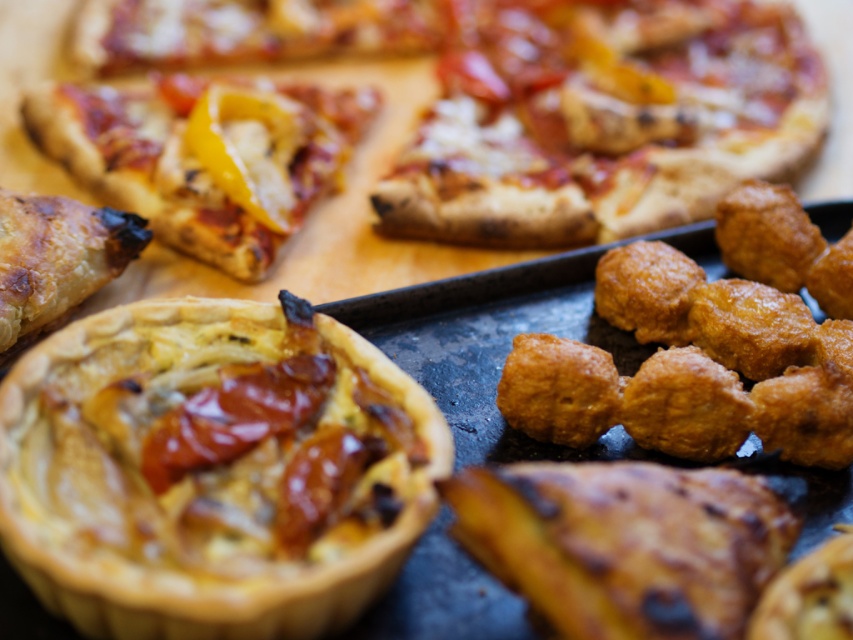
You are a customer at a bakery and want to buy the golden brown flaky pastry at lower right. The pastry is located at point coordinates of (625,544). The bakery has a rule that items located at coordinates with a sum greater than 1.5 cannot be purchased. What is the sum of the coordinates of the pastry?

The coordinates of the golden brown flaky pastry at lower right are 0.850 and 0.734. Adding these together, 0.850 plus 0.734 equals 1.584. The sum is 1.584, which is greater than 1.5, so the pastry cannot be purchased.

You are a customer at a bakery and want to choose the taller pastry between the golden brown flaky pastry at lower right and the golden brown flaky pastry at lower left. Which one should you choose?

The golden brown flaky pastry at lower left is taller than the golden brown flaky pastry at lower right, so you should choose the golden brown flaky pastry at lower left.

You are a delivery person who needs to place a hot pizza box on the wooden surface without covering the golden brown flaky pastry at lower right. The pizza box is 20 cm wide. What is the minimum distance you should keep between the edge of the pizza box and the pastry to ensure it doesn

The golden brown flaky pastry at lower right is positioned at coordinates point (625, 544). To avoid covering it, the pizza box should be placed at least 10 cm away from the pastry. This ensures the 20 cm wide pizza box doesn